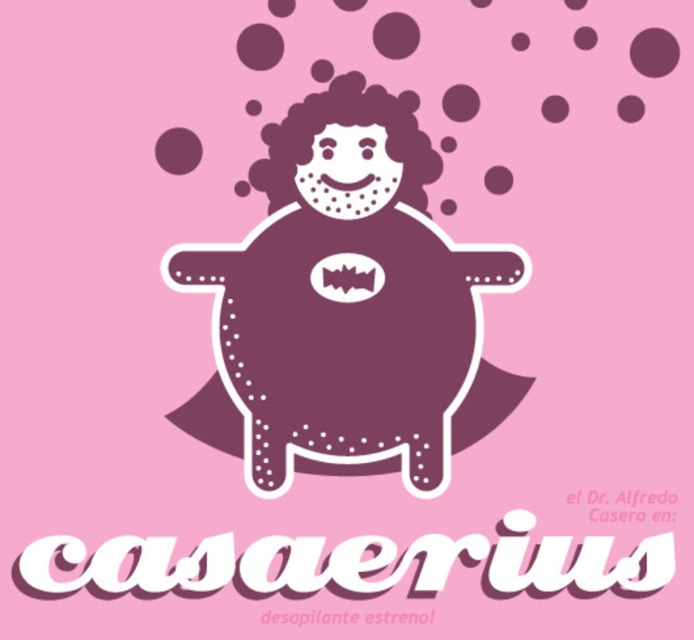
Can you confirm if purple dotted figure at center is thinner than matte purple circle at center?

Incorrect, purple dotted figure at center's width is not less than matte purple circle at center's.

Is point (407, 136) positioned after point (332, 291)?

No, it is in front of (332, 291).

Where is `purple dotted figure at center`? purple dotted figure at center is located at coordinates (347, 308).